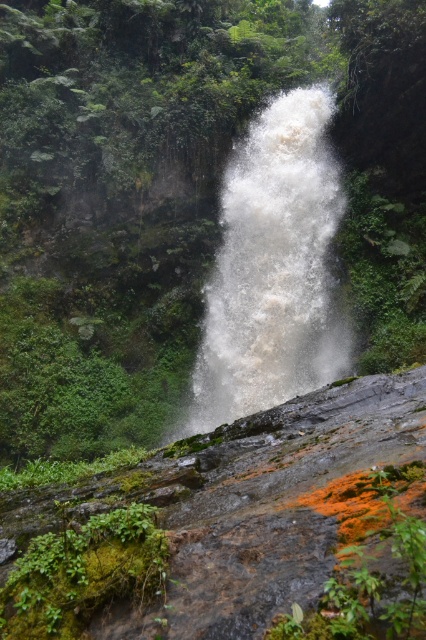
Is point (294, 292) behind point (28, 627)?

Yes.

What do you see at coordinates (273, 269) in the screenshot? I see `white frothy water at center` at bounding box center [273, 269].

Between point (339, 196) and point (71, 552), which one is positioned in front?

Point (71, 552) is in front.

Where is `white frothy water at center`? The image size is (426, 640). white frothy water at center is located at coordinates (273, 269).